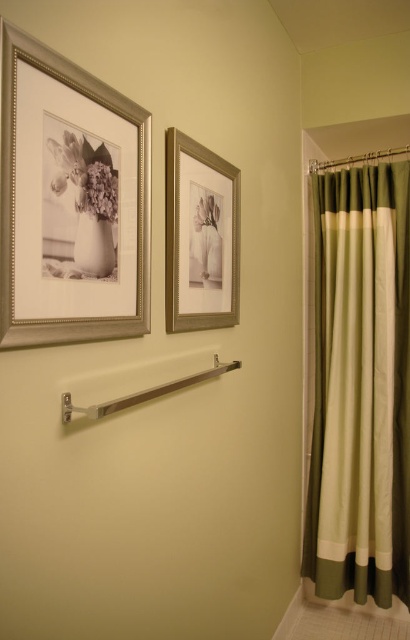
Between silver/golden metallic picture frame at upper left and matte white vase at upper left, which one appears on the right side from the viewer's perspective?

silver/golden metallic picture frame at upper left is more to the right.

Is point (125, 305) positioned after point (100, 202)?

Yes, point (125, 305) is behind point (100, 202).

This screenshot has width=410, height=640. What are the coordinates of `silver/golden metallic picture frame at upper left` in the screenshot? It's located at (70, 202).

In the scene shown: Is silver/golden metallic picture frame at upper left shorter than satin nickel towel bar at center?

No, silver/golden metallic picture frame at upper left is not shorter than satin nickel towel bar at center.

Does silver/golden metallic picture frame at upper left appear under satin nickel towel bar at center?

No.

Locate an element on the screen. The image size is (410, 640). silver/golden metallic picture frame at upper left is located at coordinates (70, 202).

Does point (109, 403) come farther from viewer compared to point (104, 200)?

No.

Where is `satin nickel towel bar at center`? This screenshot has height=640, width=410. satin nickel towel bar at center is located at coordinates (143, 394).

Where is `satin nickel towel bar at center`? Image resolution: width=410 pixels, height=640 pixels. satin nickel towel bar at center is located at coordinates (143, 394).